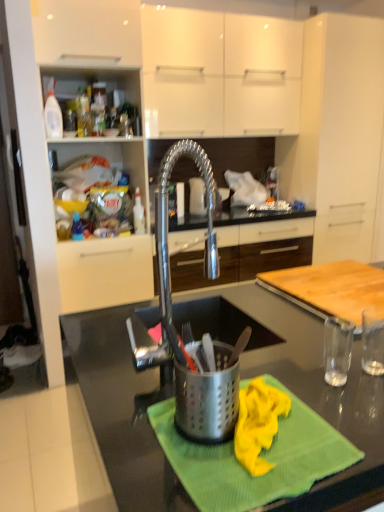
Question: Does green textured cloth at center have a lesser height compared to metallic gray countertop at center?

Choices:
 (A) yes
 (B) no

Answer: (A)

Question: Considering the relative sizes of green textured cloth at center and metallic gray countertop at center in the image provided, is green textured cloth at center wider than metallic gray countertop at center?

Choices:
 (A) no
 (B) yes

Answer: (A)

Question: From a real-world perspective, is green textured cloth at center located higher than metallic gray countertop at center?

Choices:
 (A) yes
 (B) no

Answer: (A)

Question: Is green textured cloth at center smaller than metallic gray countertop at center?

Choices:
 (A) yes
 (B) no

Answer: (A)

Question: Is metallic gray countertop at center completely or partially inside green textured cloth at center?

Choices:
 (A) no
 (B) yes

Answer: (A)

Question: From the image's perspective, relative to translucent plastic bottle at upper left, is satin nickel faucet at center, the 1th cabinetry ordered from the bottom, above or below?

Choices:
 (A) below
 (B) above

Answer: (A)

Question: Would you say satin nickel faucet at center, positioned as the 3th cabinetry in top-to-bottom order, is inside or outside translucent plastic bottle at upper left?

Choices:
 (A) outside
 (B) inside

Answer: (A)

Question: In terms of width, does satin nickel faucet at center, positioned as the 3th cabinetry in top-to-bottom order, look wider or thinner when compared to translucent plastic bottle at upper left?

Choices:
 (A) thin
 (B) wide

Answer: (B)

Question: In the image, is satin nickel faucet at center, positioned as the 3th cabinetry in top-to-bottom order, positioned in front of or behind translucent plastic bottle at upper left?

Choices:
 (A) behind
 (B) front

Answer: (A)

Question: In terms of width, does satin nickel faucet at center, positioned as the 3th cabinetry in top-to-bottom order, look wider or thinner when compared to wooden cutting board at right?

Choices:
 (A) thin
 (B) wide

Answer: (B)

Question: Is satin nickel faucet at center, positioned as the 3th cabinetry in top-to-bottom order, to the left or to the right of wooden cutting board at right in the image?

Choices:
 (A) left
 (B) right

Answer: (A)

Question: Does point (258, 225) appear closer or farther from the camera than point (291, 276)?

Choices:
 (A) closer
 (B) farther

Answer: (B)

Question: Would you say satin nickel faucet at center, positioned as the 3th cabinetry in top-to-bottom order, is inside or outside wooden cutting board at right?

Choices:
 (A) outside
 (B) inside

Answer: (A)

Question: Considering the positions of translucent plastic bottle at upper left and stainless steel utensil holder at center in the image, is translucent plastic bottle at upper left bigger or smaller than stainless steel utensil holder at center?

Choices:
 (A) small
 (B) big

Answer: (A)

Question: From the image's perspective, relative to stainless steel utensil holder at center, is translucent plastic bottle at upper left above or below?

Choices:
 (A) above
 (B) below

Answer: (A)